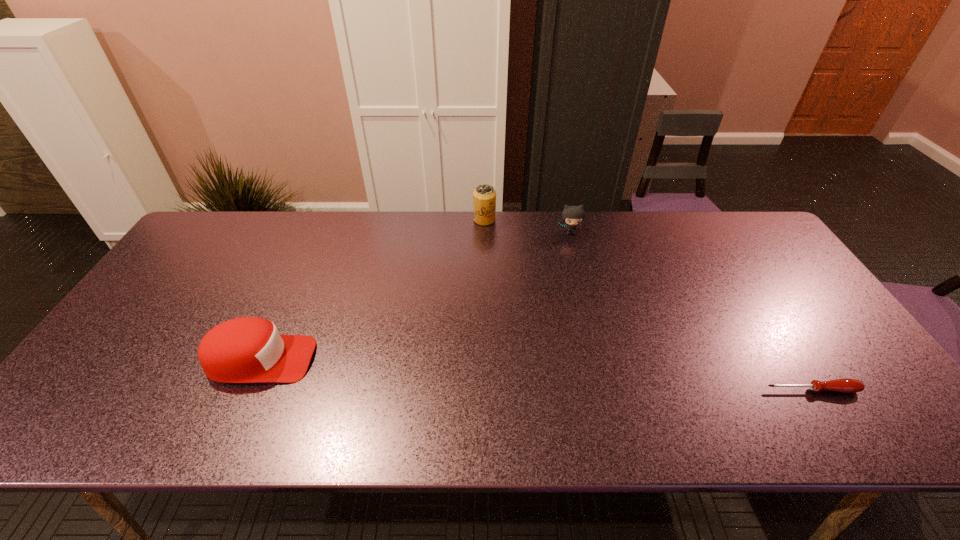
Find the location of a particular element. This screenshot has width=960, height=540. free space between the tallest object and the third nearest object is located at coordinates pos(527,226).

Point out which object is positioned as the second nearest to the second object from right to left. Please provide its 2D coordinates. Your answer should be formatted as a tuple, i.e. [(x, y)], where the tuple contains the x and y coordinates of a point satisfying the conditions above.

[(844, 385)]

Find the location of a particular element. object that ranks as the third closest to the rightmost object is located at coordinates (248, 349).

The image size is (960, 540). I want to click on free spot that satisfies the following two spatial constraints: 1. on the front-facing side of the leftmost object; 2. on the back side of the screwdriver, so click(247, 390).

Find the location of `vacant space that satisfies the following two spatial constraints: 1. on the front-facing side of the kitten; 2. on the front-facing side of the leftmost object`. vacant space that satisfies the following two spatial constraints: 1. on the front-facing side of the kitten; 2. on the front-facing side of the leftmost object is located at coordinates (602, 360).

You are a GUI agent. You are given a task and a screenshot of the screen. Output one action in this format:
    pyautogui.click(x=<x>, y=<y>)
    Task: Click on the vacant region that satisfies the following two spatial constraints: 1. on the front-facing side of the screwdriver; 2. on the right side of the baseball cap
    
    Given the screenshot: What is the action you would take?
    pyautogui.click(x=247, y=390)

At what (x,y) coordinates should I click in order to perform the action: click on vacant region that satisfies the following two spatial constraints: 1. on the front-facing side of the second farthest object; 2. on the front-facing side of the leftmost object. Please return your answer as a coordinate pair (x, y). Looking at the image, I should click on (602, 360).

In order to click on vacant space that satisfies the following two spatial constraints: 1. on the front-facing side of the shortest object; 2. on the right side of the leftmost object in this screenshot , I will do `click(247, 390)`.

Image resolution: width=960 pixels, height=540 pixels. I want to click on free location that satisfies the following two spatial constraints: 1. on the front-facing side of the kitten; 2. on the front-facing side of the baseball cap, so coord(602,360).

Locate an element on the screen. This screenshot has height=540, width=960. vacant space that satisfies the following two spatial constraints: 1. on the front-facing side of the second object from right to left; 2. on the front-facing side of the baseball cap is located at coordinates (602, 360).